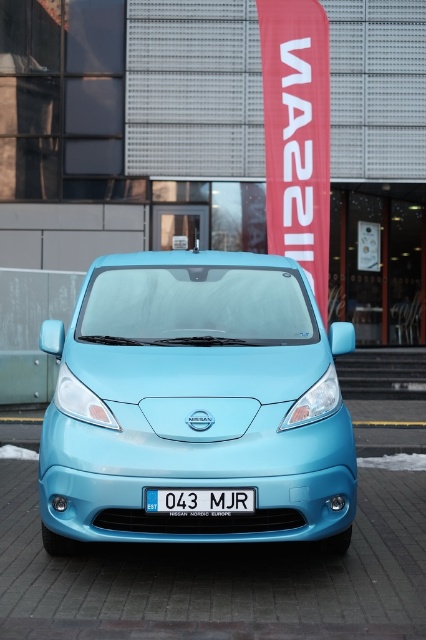
Question: Which point is farther to the camera?

Choices:
 (A) white plastic license plate at center
 (B) light blue glossy car at center

Answer: (B)

Question: Which point appears farthest from the camera in this image?

Choices:
 (A) (106, 417)
 (B) (218, 515)

Answer: (A)

Question: Is light blue glossy car at center further to camera compared to white plastic license plate at center?

Choices:
 (A) no
 (B) yes

Answer: (B)

Question: Is the position of light blue glossy car at center less distant than that of white plastic license plate at center?

Choices:
 (A) no
 (B) yes

Answer: (A)

Question: Does light blue glossy car at center have a lesser width compared to white plastic license plate at center?

Choices:
 (A) no
 (B) yes

Answer: (A)

Question: Among these objects, which one is farthest from the camera?

Choices:
 (A) white plastic license plate at center
 (B) light blue glossy car at center

Answer: (B)